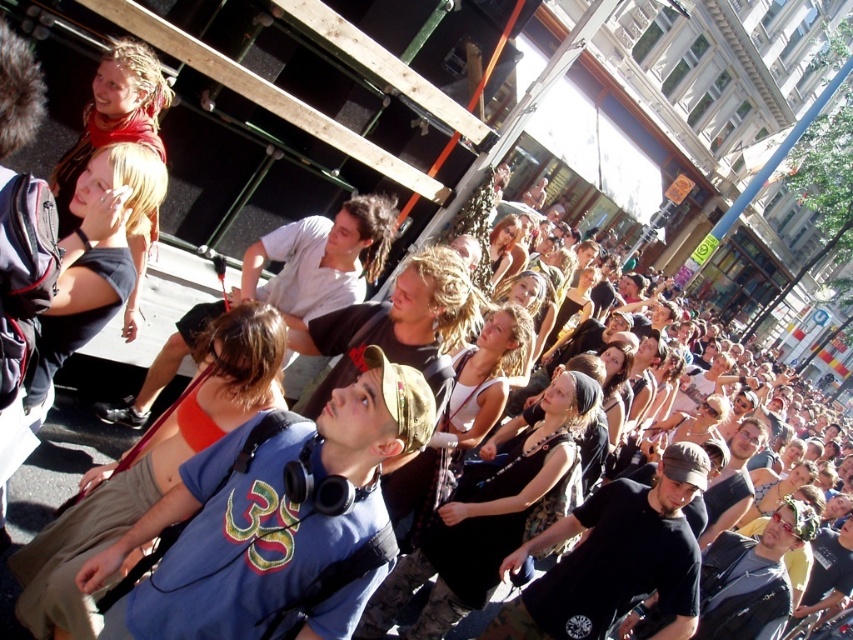
You are part of the crowd looking upwards and need to pass through the crowd to reach someone behind the blue fabric shirt at center and the matte white shirt at center. Which of these two shirts should you move around to get to the person behind them?

You should move around the blue fabric shirt at center because it is in front of the matte white shirt at center, so moving around the blue fabric shirt at center would allow you to reach the person behind both more effectively.